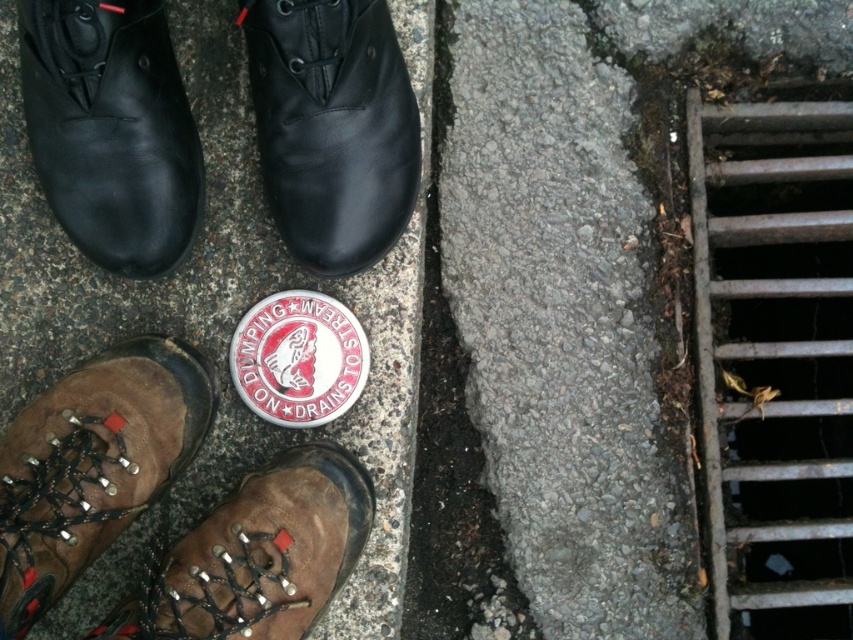
Based on the photo, is black leather shoe at upper center taller than brown leather shoe at lower left?

Yes, black leather shoe at upper center is taller than brown leather shoe at lower left.

Does black leather shoe at upper center appear on the left side of brown leather shoe at lower left?

No, black leather shoe at upper center is not to the left of brown leather shoe at lower left.

The image size is (853, 640). What are the coordinates of `black leather shoe at upper center` in the screenshot? It's located at (332, 128).

Can you confirm if gray concrete pavement at center is shorter than black leather shoe at upper center?

In fact, gray concrete pavement at center may be taller than black leather shoe at upper center.

Who is lower down, gray concrete pavement at center or black leather shoe at upper center?

gray concrete pavement at center is lower down.

Locate an element on the screen. gray concrete pavement at center is located at coordinates (154, 282).

Which of these two, black leather shoe at upper center or brown leather boot at lower left, stands taller?

Standing taller between the two is black leather shoe at upper center.

From the picture: Who is more forward, (338,161) or (138,348)?

Point (338,161)

At what (x,y) coordinates should I click in order to perform the action: click on black leather shoe at upper center. Please return your answer as a coordinate pair (x, y). Looking at the image, I should click on (332, 128).